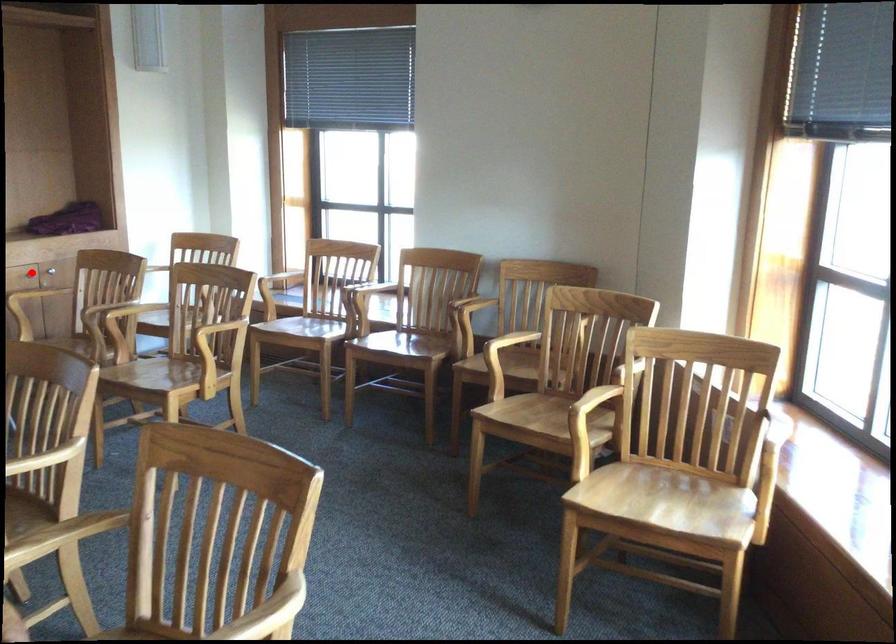
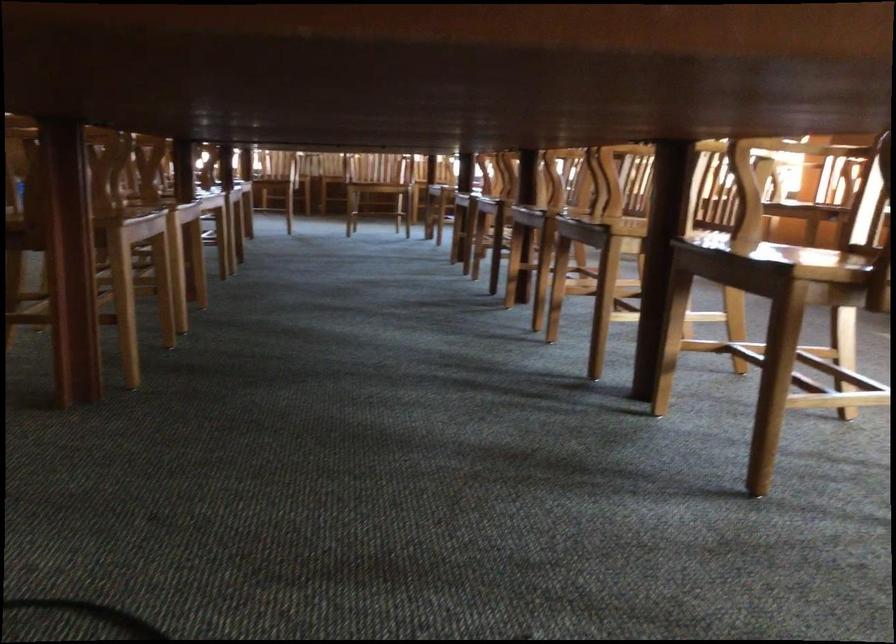
Question: I am providing you with two images of the same scene from different viewpoints. A red point is marked on the first image. Is the red point's position out of view in image 2?

Choices:
 (A) Yes
 (B) No

Answer: (A)